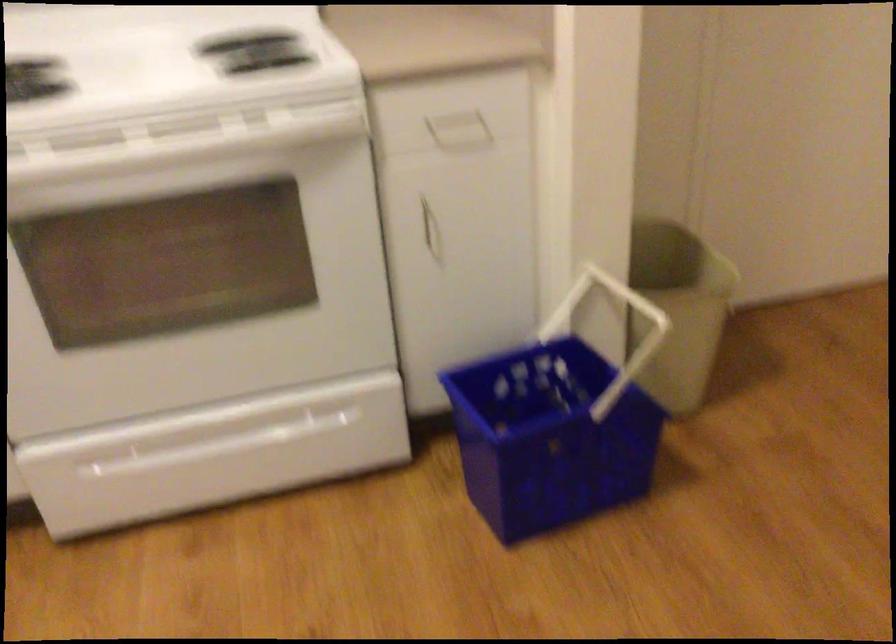
At what (x,y) coordinates should I click in order to perform the action: click on white basket handle. Please return your answer as a coordinate pair (x, y). The image size is (896, 644). Looking at the image, I should click on (616, 330).